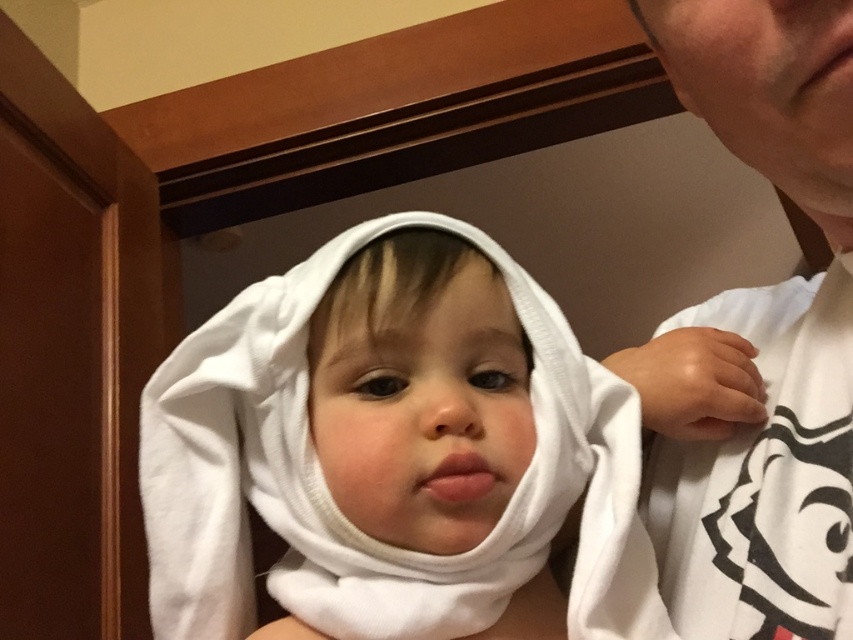
Does white soft cloth at center have a lesser height compared to white cotton shirt at upper right?

Indeed, white soft cloth at center has a lesser height compared to white cotton shirt at upper right.

Based on the photo, which is below, white soft cloth at center or white cotton shirt at upper right?

white soft cloth at center

Where is `white soft cloth at center`? white soft cloth at center is located at coordinates (334, 502).